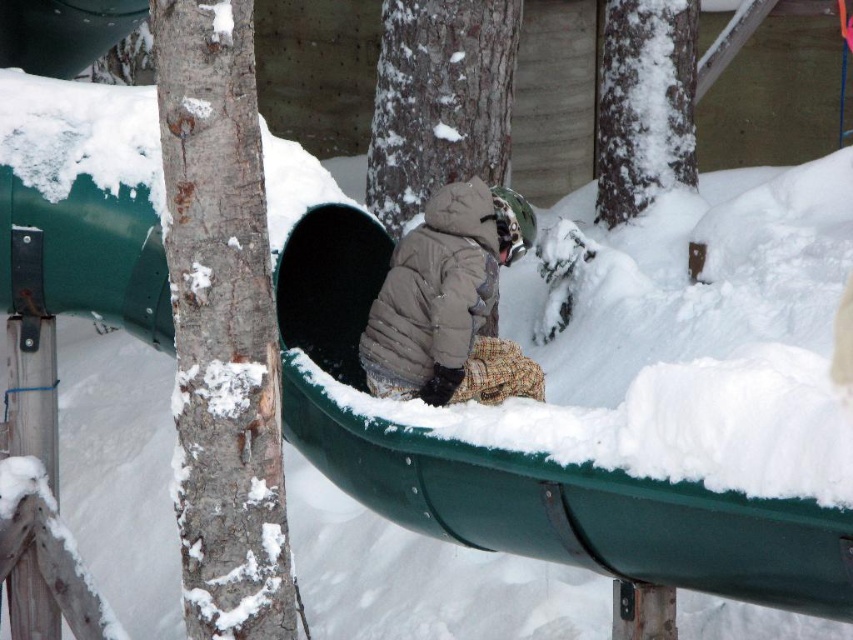
Can you confirm if gray bark tree at left is wider than snow-covered bark at upper center?

No, gray bark tree at left is not wider than snow-covered bark at upper center.

Does gray bark tree at left have a lesser width compared to snow-covered bark at upper center?

Yes, gray bark tree at left is thinner than snow-covered bark at upper center.

Is point (235, 528) positioned before point (677, 77)?

Yes, it is.

You are a GUI agent. You are given a task and a screenshot of the screen. Output one action in this format:
    pyautogui.click(x=<x>, y=<y>)
    Task: Click on the gray bark tree at left
    The image size is (853, 640).
    Given the screenshot: What is the action you would take?
    pyautogui.click(x=221, y=326)

Between point (200, 321) and point (412, 3), which one is positioned in front?

Point (200, 321) is more forward.

Does gray bark tree at left lie behind smooth bark tree at center?

No, gray bark tree at left is in front of smooth bark tree at center.

I want to click on gray bark tree at left, so click(x=221, y=326).

Measure the distance between smooth bark tree at center and snow-covered bark at upper center.

9.51 feet

Who is positioned more to the left, smooth bark tree at center or snow-covered bark at upper center?

Positioned to the left is smooth bark tree at center.

You are a GUI agent. You are given a task and a screenshot of the screen. Output one action in this format:
    pyautogui.click(x=<x>, y=<y>)
    Task: Click on the smooth bark tree at center
    The height and width of the screenshot is (640, 853).
    Given the screenshot: What is the action you would take?
    pyautogui.click(x=439, y=99)